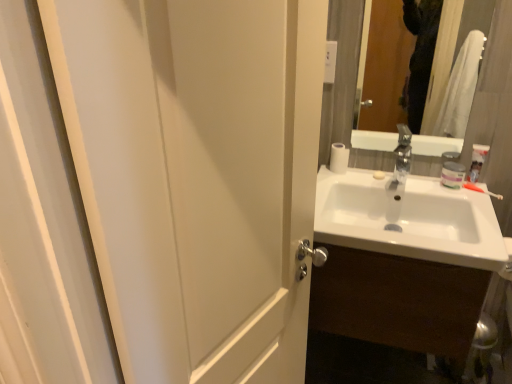
Question: Is white glossy sink at right directly adjacent to white matte jar at upper right?

Choices:
 (A) no
 (B) yes

Answer: (A)

Question: Is there a large distance between white glossy sink at right and white matte jar at upper right?

Choices:
 (A) yes
 (B) no

Answer: (B)

Question: From a real-world perspective, does white glossy sink at right stand above white matte jar at upper right?

Choices:
 (A) no
 (B) yes

Answer: (A)

Question: From the image's perspective, is white glossy sink at right over white matte jar at upper right?

Choices:
 (A) yes
 (B) no

Answer: (B)

Question: Can you confirm if white glossy sink at right is wider than white matte jar at upper right?

Choices:
 (A) yes
 (B) no

Answer: (A)

Question: Considering the positions of point 331,157 and point 412,238, is point 331,157 closer or farther from the camera than point 412,238?

Choices:
 (A) farther
 (B) closer

Answer: (A)

Question: Based on their positions, is white matte toilet paper at upper right located to the left or right of white glossy sink at right?

Choices:
 (A) right
 (B) left

Answer: (B)

Question: Would you say white matte toilet paper at upper right is inside or outside white glossy sink at right?

Choices:
 (A) inside
 (B) outside

Answer: (B)

Question: From a real-world perspective, is white matte toilet paper at upper right above or below white glossy sink at right?

Choices:
 (A) below
 (B) above

Answer: (B)

Question: Is point (330, 160) closer or farther from the camera than point (301, 34)?

Choices:
 (A) closer
 (B) farther

Answer: (B)

Question: Considering the positions of white matte toilet paper at upper right and white matte door at left in the image, is white matte toilet paper at upper right wider or thinner than white matte door at left?

Choices:
 (A) wide
 (B) thin

Answer: (B)

Question: Looking at the image, does white matte toilet paper at upper right seem bigger or smaller compared to white matte door at left?

Choices:
 (A) big
 (B) small

Answer: (B)

Question: Considering the positions of white matte toilet paper at upper right and white matte door at left in the image, is white matte toilet paper at upper right taller or shorter than white matte door at left?

Choices:
 (A) short
 (B) tall

Answer: (A)

Question: From the image's perspective, is white matte door at left positioned above or below white glossy sink at right?

Choices:
 (A) below
 (B) above

Answer: (B)

Question: From a real-world perspective, relative to white glossy sink at right, is white matte door at left vertically above or below?

Choices:
 (A) below
 (B) above

Answer: (B)